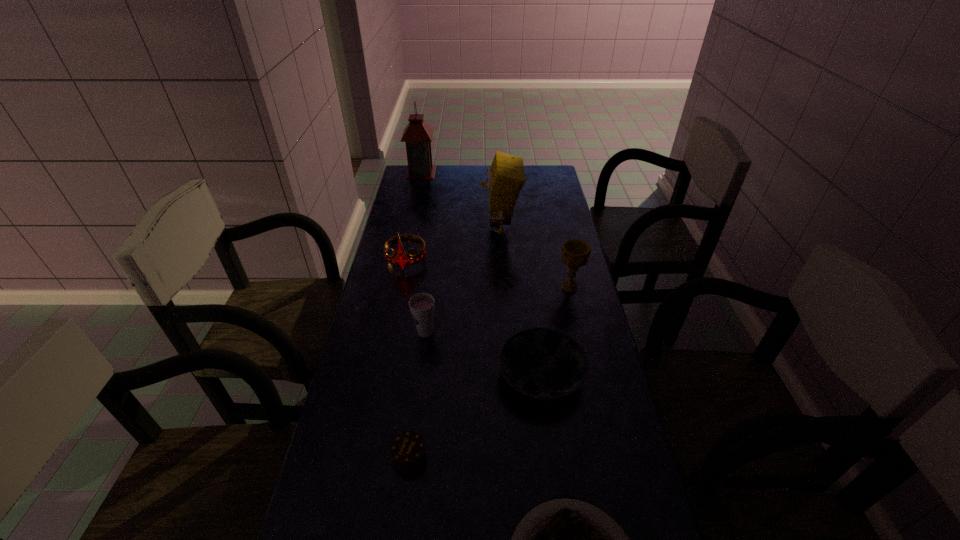
Find the location of a particular element. The height and width of the screenshot is (540, 960). unoccupied area between the farthest object and the sponge is located at coordinates (461, 200).

Locate an element on the screen. This screenshot has width=960, height=540. vacant point located between the tiara and the taller plate is located at coordinates (473, 318).

Find the location of `free area in between the seventh farthest object and the taller plate`. free area in between the seventh farthest object and the taller plate is located at coordinates (475, 415).

This screenshot has width=960, height=540. What are the coordinates of `free space between the tiara and the chalice` in the screenshot? It's located at (488, 274).

You are a GUI agent. You are given a task and a screenshot of the screen. Output one action in this format:
    pyautogui.click(x=<x>, y=<y>)
    Task: Click on the object that stands as the closest to the nearer plate
    Image resolution: width=960 pixels, height=540 pixels.
    Given the screenshot: What is the action you would take?
    pyautogui.click(x=408, y=450)

Where is `object that is the seventh closest to the farther plate`? The height and width of the screenshot is (540, 960). object that is the seventh closest to the farther plate is located at coordinates (418, 134).

You are a GUI agent. You are given a task and a screenshot of the screen. Output one action in this format:
    pyautogui.click(x=<x>, y=<y>)
    Task: Click on the vacant region that satisfies the following two spatial constraints: 1. on the back side of the farther plate; 2. on the left side of the chalice
    The image size is (960, 540).
    Given the screenshot: What is the action you would take?
    pyautogui.click(x=530, y=287)

Identify the location of vacant region that satisfies the following two spatial constraints: 1. on the front side of the taller plate; 2. on the left side of the cup. (420, 374).

At what (x,y) coordinates should I click in order to perform the action: click on vacant space that satisfies the following two spatial constraints: 1. on the back side of the cup; 2. on the right side of the second nearest object. Please return your answer as a coordinate pair (x, y). Looking at the image, I should click on (425, 333).

The image size is (960, 540). Find the location of `vacant region that satisfies the following two spatial constraints: 1. on the front-facing side of the third farthest object; 2. on the left side of the chalice`. vacant region that satisfies the following two spatial constraints: 1. on the front-facing side of the third farthest object; 2. on the left side of the chalice is located at coordinates (400, 287).